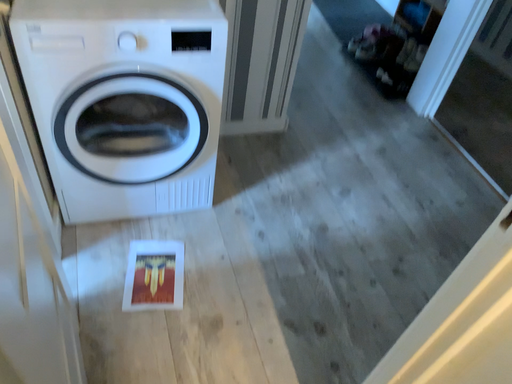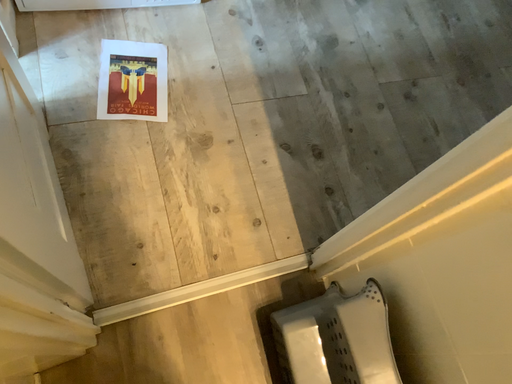
Question: Which way did the camera rotate in the video?

Choices:
 (A) rotated downward
 (B) rotated upward

Answer: (A)